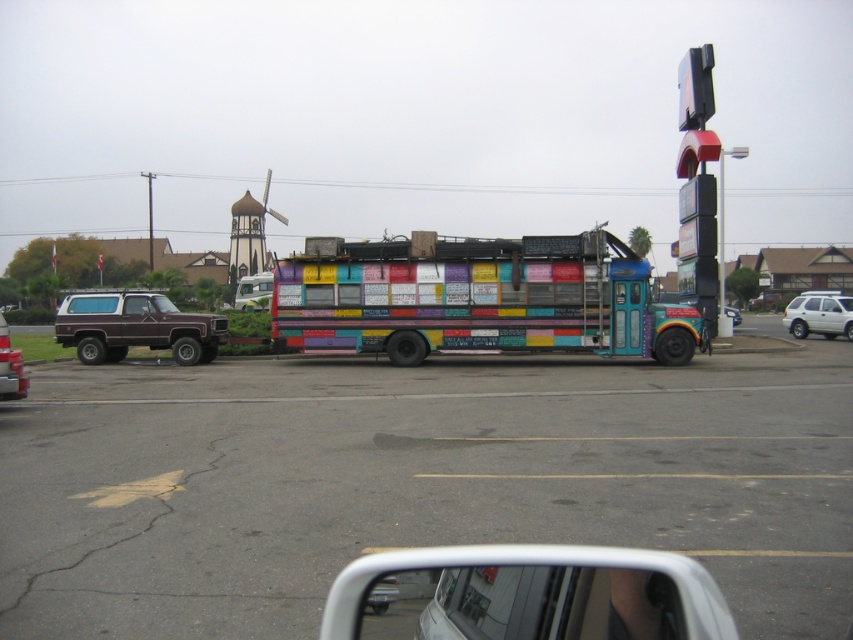
You are driving a car and want to park between the brown matte truck at left and the matte brown suv at left. Is there enough space between them to fit your car?

The brown matte truck at left is to the left of the matte brown suv at left, so there is no space between them. You cannot park between them.

You are a driver trying to exit the parking lot and need to decide which vehicle to pass first. Based on their positions, which vehicle should you go around first, the brown matte truck at left or the white matte car at right?

The brown matte truck at left is below the white matte car at right, so you should go around the brown matte truck at left first since it is closer to the ground and might block your path if not addressed first.

You are driving a car and want to park in the parking lot. You see the multicolored painted bus at center and the brown matte truck at left. Which vehicle takes up more space in the parking lot?

The multicolored painted bus at center takes up more space in the parking lot because it is larger in size than the brown matte truck at left.